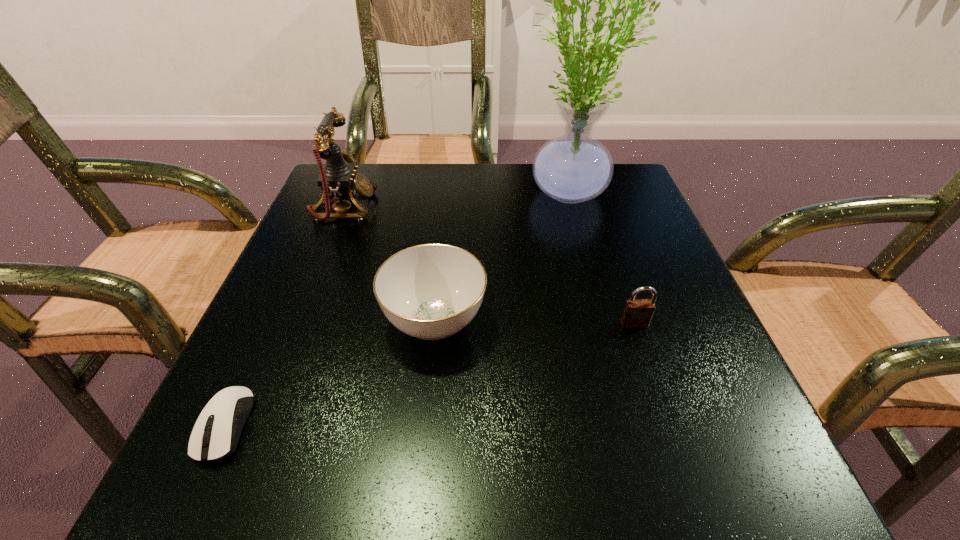
Locate an element on the screen. vacant region located on the back of the shortest object is located at coordinates (293, 278).

I want to click on flower arrangement present at the far edge, so click(x=573, y=168).

Locate an element on the screen. The height and width of the screenshot is (540, 960). telephone that is at the far edge is located at coordinates (338, 180).

In order to click on object at the near edge in this screenshot , I will do `click(218, 441)`.

You are a GUI agent. You are given a task and a screenshot of the screen. Output one action in this format:
    pyautogui.click(x=<x>, y=<y>)
    Task: Click on the telephone that is at the left edge
    This screenshot has width=960, height=540.
    Given the screenshot: What is the action you would take?
    pos(338,180)

I want to click on mouse located at the left edge, so click(218, 441).

Where is `flower arrangement that is at the right edge`? The width and height of the screenshot is (960, 540). flower arrangement that is at the right edge is located at coordinates (573, 168).

This screenshot has width=960, height=540. What are the coordinates of `padlock that is at the right edge` in the screenshot? It's located at (637, 313).

Where is `object that is positioned at the far left corner`? The height and width of the screenshot is (540, 960). object that is positioned at the far left corner is located at coordinates (338, 180).

This screenshot has height=540, width=960. What are the coordinates of `object located at the near left corner` in the screenshot? It's located at (218, 441).